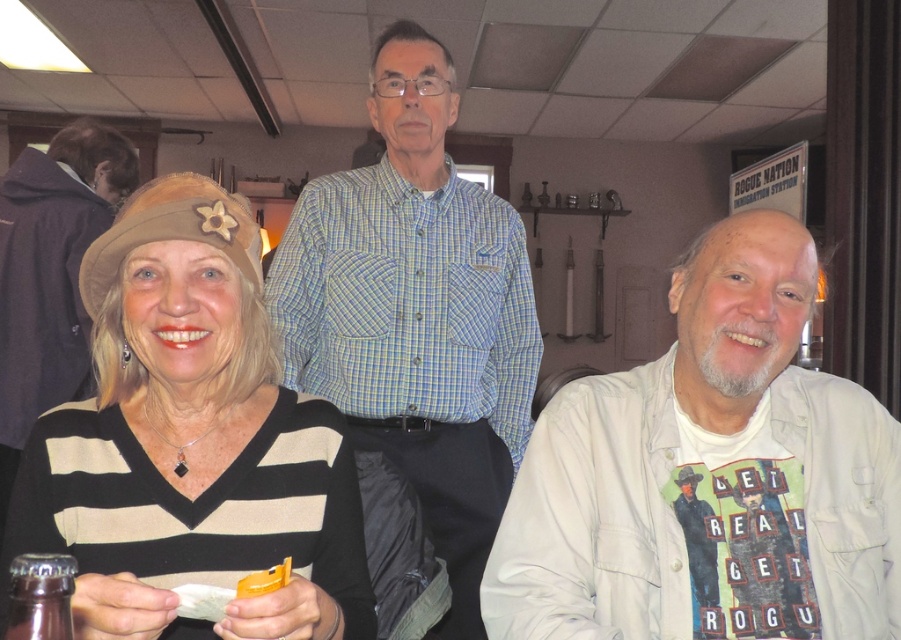
Based on the coordinates provided in the scene description, where is the matte brown hat at left located?

The matte brown hat at left is located at the coordinates point (190, 442).

You are a waiter carrying a tray of drinks. You need to place a new drink between the white cotton shirt at right and the brown glass bottle at lower left. Is there enough space between them to fit a standard 8.5 inch diameter drink?

The distance between the white cotton shirt at right and the brown glass bottle at lower left is 27.50 inches. Since the drink requires 8.5 inches of space, there is sufficient space to place the drink between them.